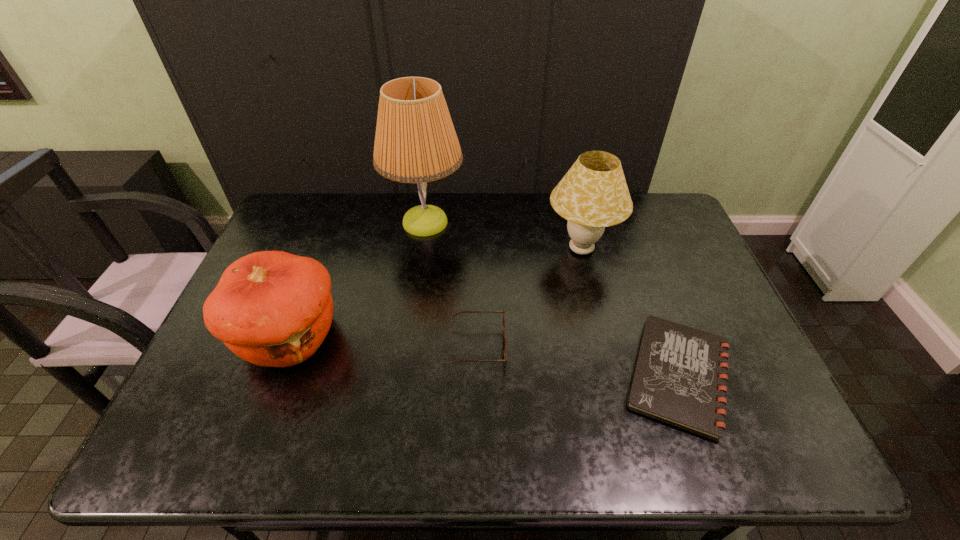
Find the location of a particular element. free space that satisfies the following two spatial constraints: 1. at the front view of the second shortest object; 2. on the right side of the shortest object is located at coordinates pos(478,376).

Identify the location of free location that satisfies the following two spatial constraints: 1. at the front view of the spectacles; 2. on the right side of the shortest object. The height and width of the screenshot is (540, 960). (478, 376).